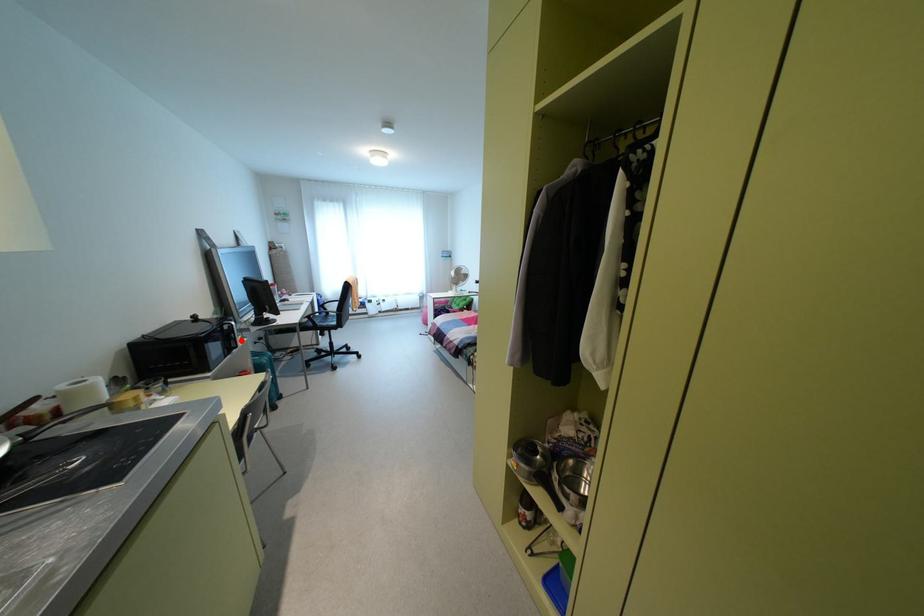
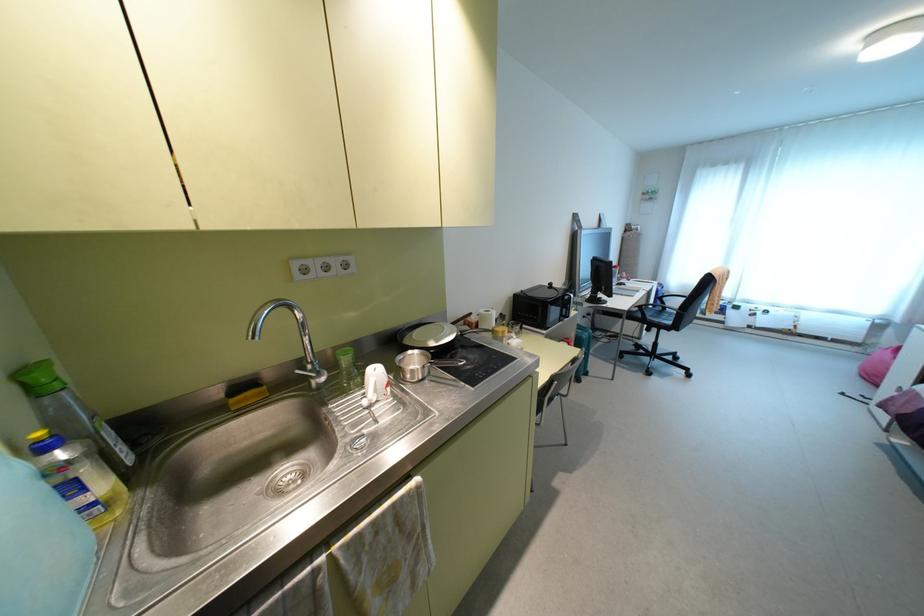
Locate, in the second image, the point that corresponds to the highlighted location in the first image.

(573, 313)